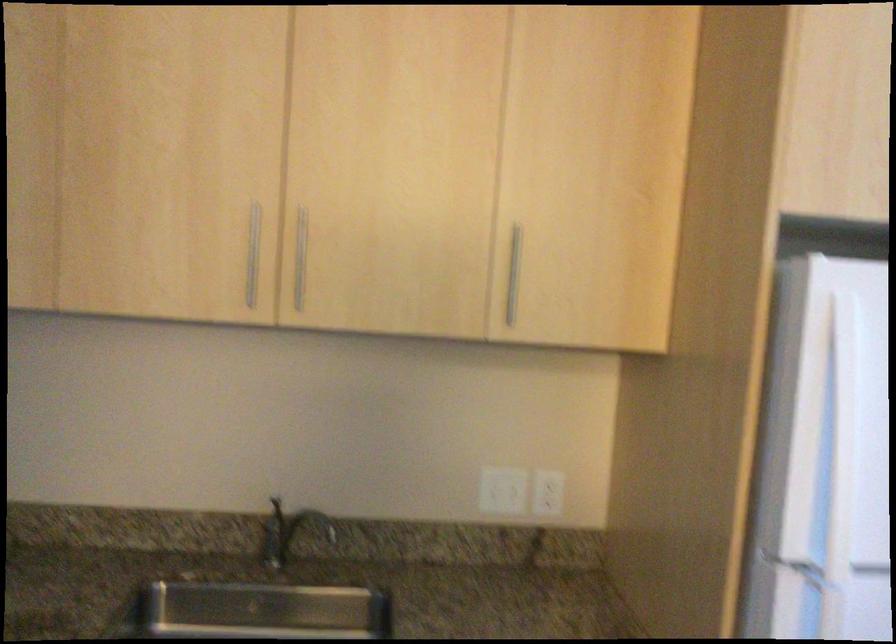
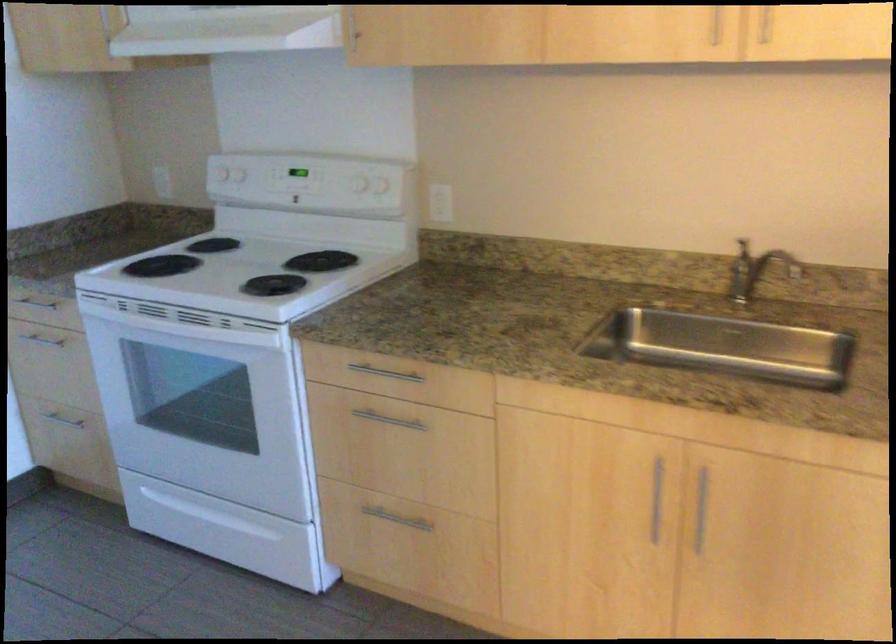
Question: The images are taken continuously from a first-person perspective. In which direction is your viewpoint rotating?

Choices:
 (A) Left
 (B) Right
 (C) Up
 (D) Down

Answer: (A)